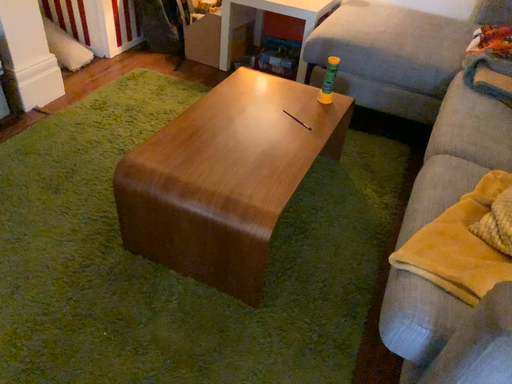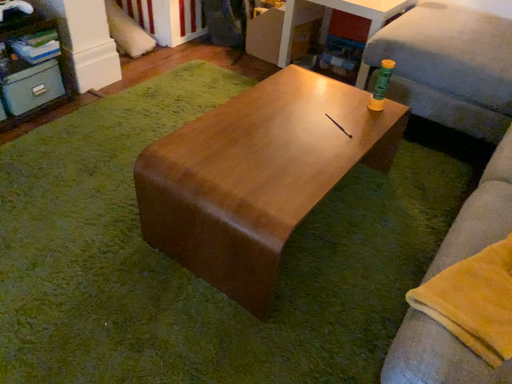
Question: How did the camera likely rotate when shooting the video?

Choices:
 (A) rotated left
 (B) rotated right

Answer: (A)